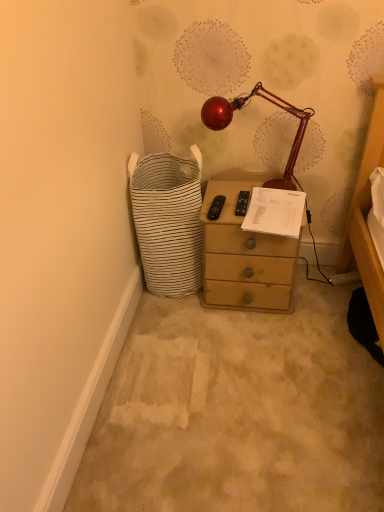
Locate an element on the screen. vacant space to the right of matte brown chest of drawers at center is located at coordinates 318,297.